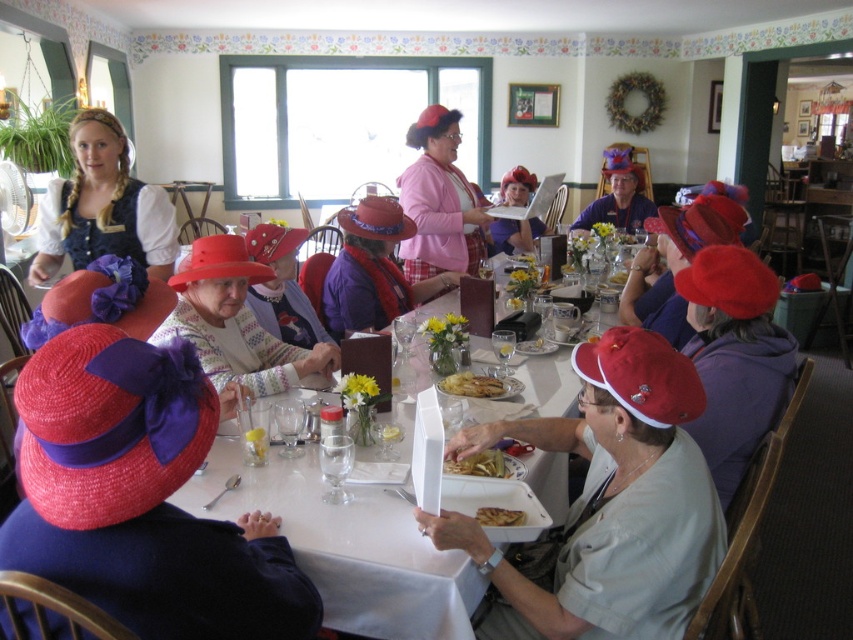
Does matte pink hat at center appear on the left side of golden crispy fries at center?

No, matte pink hat at center is not to the left of golden crispy fries at center.

Does point (494, 244) come behind point (468, 388)?

Yes, point (494, 244) is farther from viewer.

I want to click on matte pink hat at center, so click(x=515, y=234).

Is matte pink hat at center taller than yellowish fried food at lower center?

Yes, matte pink hat at center is taller than yellowish fried food at lower center.

Is matte pink hat at center closer to the viewer compared to yellowish fried food at lower center?

No, matte pink hat at center is further to the viewer.

This screenshot has height=640, width=853. What do you see at coordinates (515, 234) in the screenshot? I see `matte pink hat at center` at bounding box center [515, 234].

This screenshot has width=853, height=640. What are the coordinates of `matte pink hat at center` in the screenshot? It's located at (515, 234).

Is white paper plate at center taller than golden crispy fries at center?

Correct, white paper plate at center is much taller as golden crispy fries at center.

Is white paper plate at center positioned in front of golden crispy fries at center?

Yes.

The height and width of the screenshot is (640, 853). Describe the element at coordinates (238, 310) in the screenshot. I see `white paper plate at center` at that location.

Image resolution: width=853 pixels, height=640 pixels. Find the location of `white paper plate at center`. white paper plate at center is located at coordinates coord(238,310).